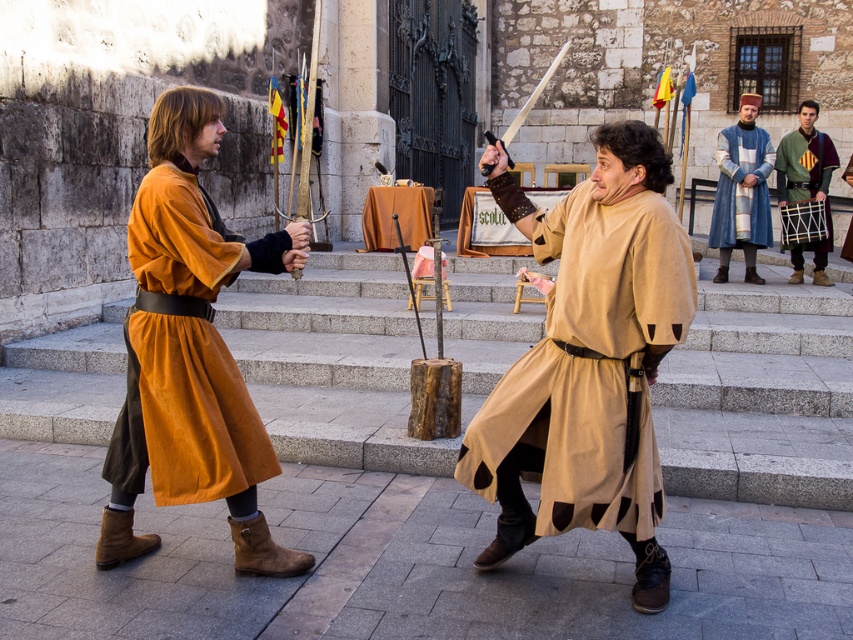
Locate an element on the screen. This screenshot has width=853, height=640. beige fabric tunic at center is located at coordinates (589, 358).

Does beige fabric tunic at center have a lesser height compared to matte orange robe at left?

No, beige fabric tunic at center is not shorter than matte orange robe at left.

This screenshot has height=640, width=853. Find the location of `beige fabric tunic at center`. beige fabric tunic at center is located at coordinates (589, 358).

Measure the distance between beige fabric tunic at center and green woolen tunic at right.

The distance of beige fabric tunic at center from green woolen tunic at right is 7.05 meters.

Can you confirm if beige fabric tunic at center is thinner than green woolen tunic at right?

No, beige fabric tunic at center is not thinner than green woolen tunic at right.

At what (x,y) coordinates should I click in order to perform the action: click on beige fabric tunic at center. Please return your answer as a coordinate pair (x, y). Looking at the image, I should click on point(589,358).

Can you confirm if matte orange robe at left is bigger than blue woolen robe at upper right?

No, matte orange robe at left is not bigger than blue woolen robe at upper right.

Does point (207, 234) come behind point (740, 131)?

No, it is not.

Between point (209, 300) and point (741, 221), which one is positioned behind?

Point (741, 221)

Identify the location of matte orange robe at left. The width and height of the screenshot is (853, 640). (192, 412).